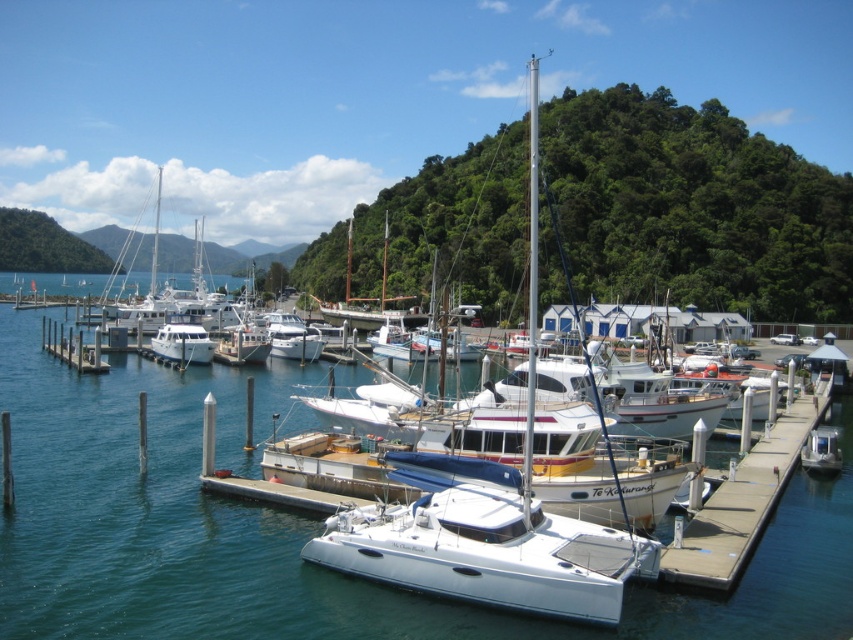
Who is lower down, smooth concrete dock at lower right or white glossy boat at center?

Positioned lower is smooth concrete dock at lower right.

Which is behind, point (791, 454) or point (202, 339)?

Positioned behind is point (202, 339).

Identify the location of smooth concrete dock at lower right. (741, 500).

Can you confirm if white glossy catamaran at center is smaller than white glossy boat at center?

Yes, white glossy catamaran at center is smaller than white glossy boat at center.

Who is more forward, (566,577) or (158,353)?

Positioned in front is point (566,577).

Identify the location of white glossy catamaran at center. This screenshot has width=853, height=640. (485, 541).

The width and height of the screenshot is (853, 640). Describe the element at coordinates (294, 525) in the screenshot. I see `white glossy water at center` at that location.

Can you confirm if white glossy water at center is wider than white wooden dock at left?

Correct, the width of white glossy water at center exceeds that of white wooden dock at left.

Measure the distance between point (183, 541) and camera.

The distance of point (183, 541) from camera is 62.40 feet.

Identify the location of white glossy water at center. (294, 525).